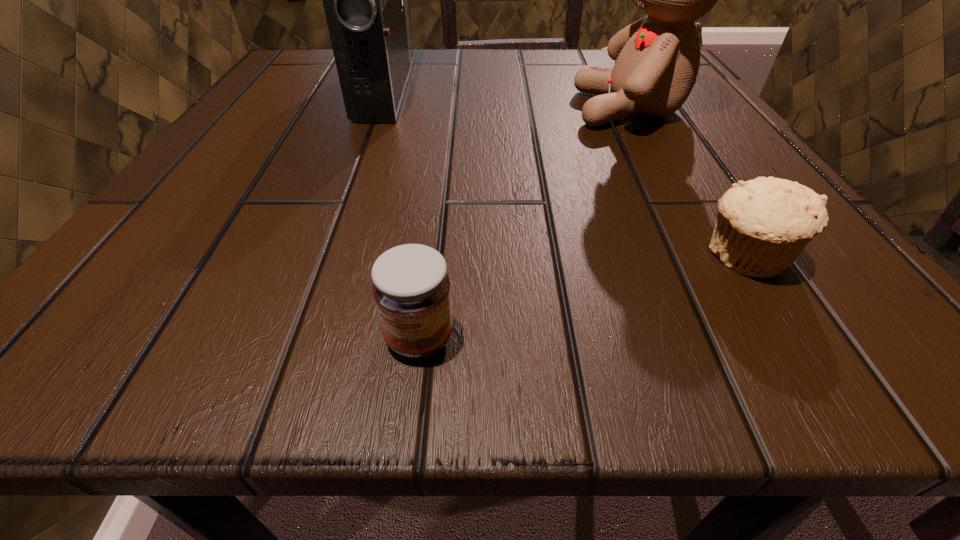
The height and width of the screenshot is (540, 960). I want to click on free location located 0.270m on the left of the nearest object, so click(72, 338).

At what (x,y) coordinates should I click in order to perform the action: click on radio receiver that is at the far edge. Please return your answer as a coordinate pair (x, y). The width and height of the screenshot is (960, 540). Looking at the image, I should click on (366, 0).

The width and height of the screenshot is (960, 540). Identify the location of rag_doll present at the far edge. tap(657, 58).

The image size is (960, 540). Identify the location of object located in the near edge section of the desktop. (411, 287).

This screenshot has height=540, width=960. I want to click on rag_doll present at the right edge, so click(x=657, y=58).

I want to click on muffin located in the right edge section of the desktop, so click(x=762, y=226).

I want to click on object positioned at the far right corner, so click(x=657, y=58).

Identify the location of vacant region at the far edge of the desktop. This screenshot has width=960, height=540. (529, 56).

In the image, there is a desktop. Where is `vacant space at the near edge`? This screenshot has width=960, height=540. vacant space at the near edge is located at coordinates (307, 355).

The height and width of the screenshot is (540, 960). In the image, there is a desktop. Identify the location of free space at the left edge. (247, 219).